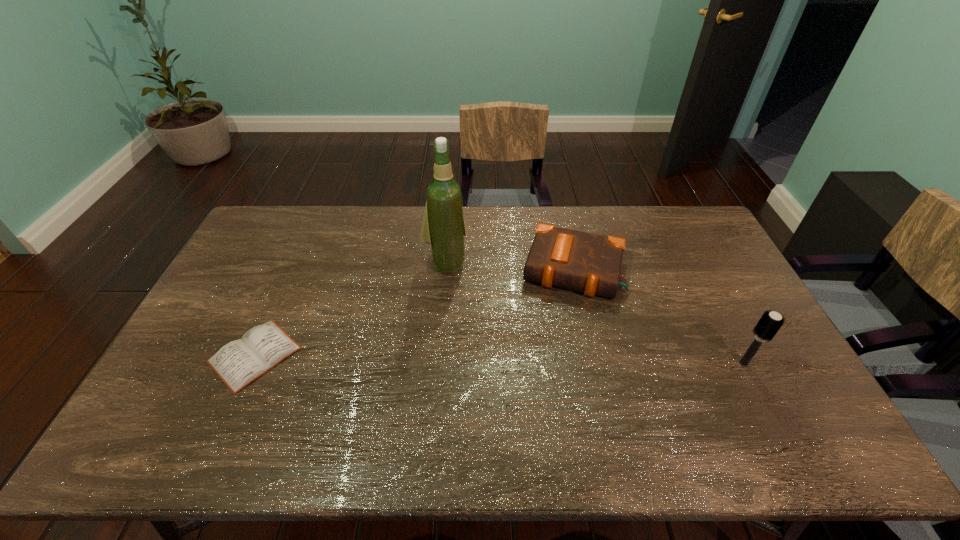
Locate an element on the screen. This screenshot has width=960, height=540. vacant space that satisfies the following two spatial constraints: 1. on the back side of the third object from right to left; 2. on the right side of the diary is located at coordinates (296, 262).

The height and width of the screenshot is (540, 960). I want to click on free space that satisfies the following two spatial constraints: 1. on the front side of the tallest object; 2. on the left side of the hairbrush, so click(x=437, y=363).